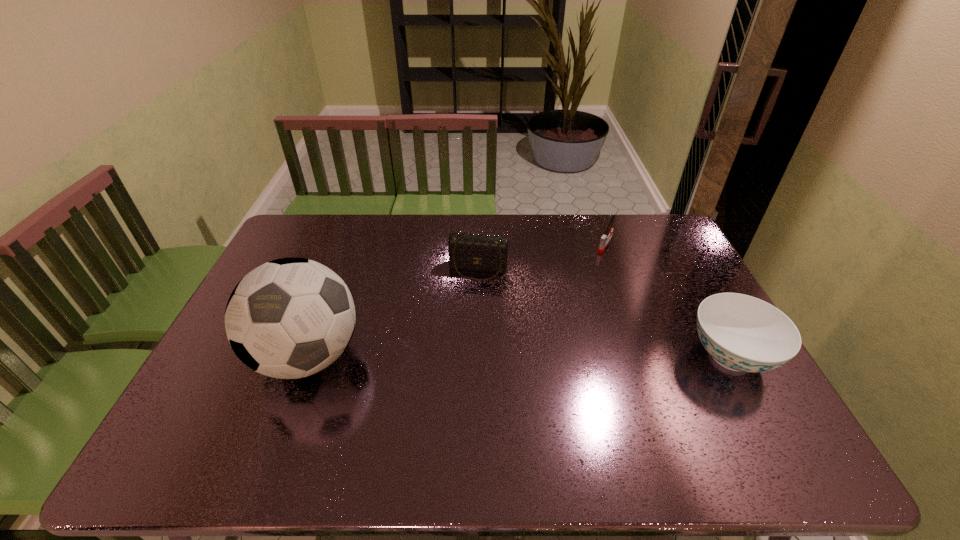
Identify the location of soccer ball. The image size is (960, 540). (289, 318).

The height and width of the screenshot is (540, 960). Identify the location of the leftmost object. (289, 318).

Where is `the rightmost object`? The image size is (960, 540). the rightmost object is located at coordinates (742, 333).

Identify the location of the shortest object. click(x=604, y=240).

I want to click on the second object from right to left, so click(x=604, y=240).

What are the coordinates of `the third nearest object` in the screenshot? It's located at (476, 252).

You are a GUI agent. You are given a task and a screenshot of the screen. Output one action in this format:
    pyautogui.click(x=<x>, y=<y>)
    Task: Click on the third object from right to left
    This screenshot has width=960, height=540.
    Given the screenshot: What is the action you would take?
    [x=476, y=252]

You are a GUI agent. You are given a task and a screenshot of the screen. Output one action in this format:
    pyautogui.click(x=<x>, y=<y>)
    Task: Click on the free point located on the front of the rightmost object
    The image size is (960, 540).
    Given the screenshot: What is the action you would take?
    pyautogui.click(x=762, y=414)

Image resolution: width=960 pixels, height=540 pixels. In order to click on free space located 0.180m on the handle side of the stapler in this screenshot , I will do `click(583, 280)`.

Locate an element on the screen. free region located on the handle side of the stapler is located at coordinates (581, 284).